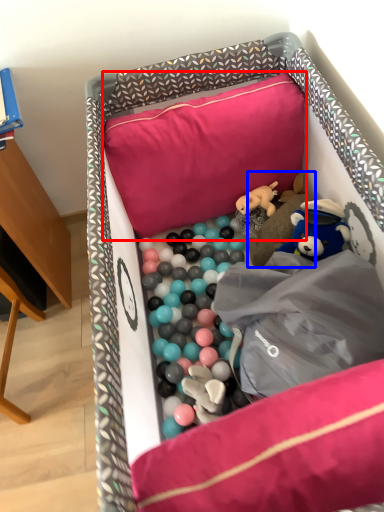
Question: Which object appears farthest to the camera in this image, pillow (highlighted by a red box) or toy (highlighted by a blue box)?

Choices:
 (A) pillow
 (B) toy

Answer: (B)